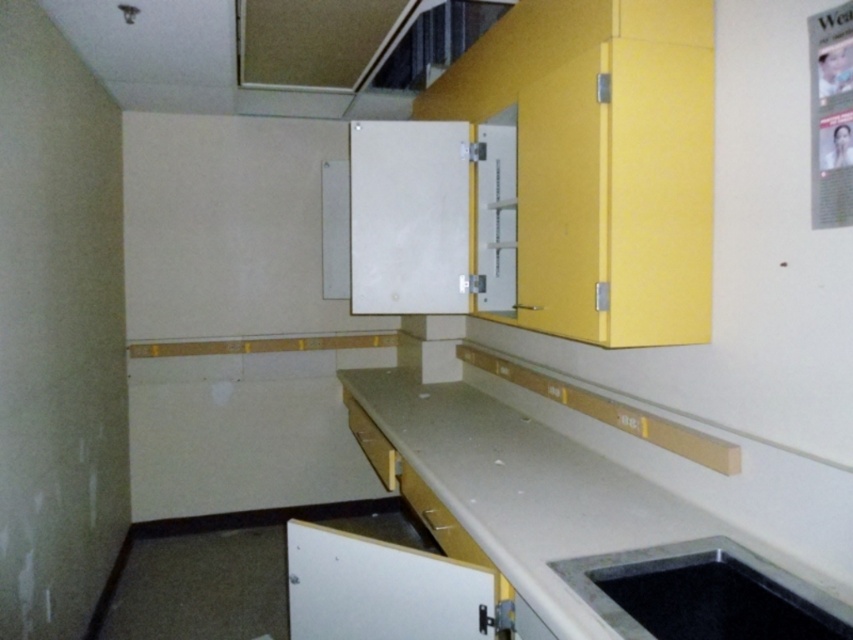
Question: Can you confirm if white laminate countertop at center is bigger than black granite sink at lower right?

Choices:
 (A) yes
 (B) no

Answer: (A)

Question: Which object is closer to the camera taking this photo?

Choices:
 (A) white laminate countertop at center
 (B) black granite sink at lower right

Answer: (A)

Question: Among these points, which one is farthest from the camera?

Choices:
 (A) (392, 401)
 (B) (616, 580)

Answer: (A)

Question: Which point is farther from the camera taking this photo?

Choices:
 (A) (618, 468)
 (B) (610, 572)

Answer: (A)

Question: Where is white laminate countertop at center located in relation to black granite sink at lower right in the image?

Choices:
 (A) left
 (B) right

Answer: (A)

Question: Can you confirm if white laminate countertop at center is smaller than black granite sink at lower right?

Choices:
 (A) no
 (B) yes

Answer: (A)